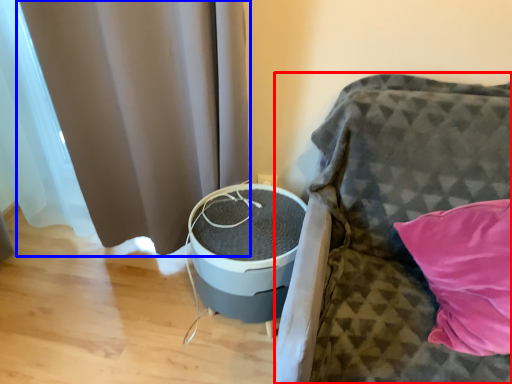
Question: Among these objects, which one is nearest to the camera, furniture (highlighted by a red box) or curtain (highlighted by a blue box)?

Choices:
 (A) furniture
 (B) curtain

Answer: (A)